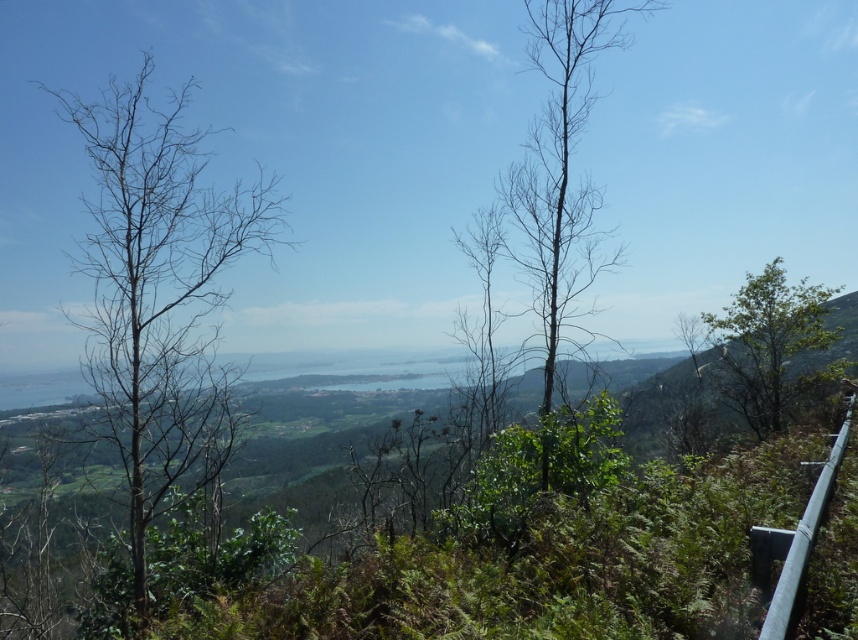
Which is above, bare wood tree at center or green leafy tree at right?

bare wood tree at center is above.

Where is `bare wood tree at center`? The image size is (858, 640). bare wood tree at center is located at coordinates (560, 168).

Does point (137, 145) come closer to viewer compared to point (754, 570)?

No.

Which is below, bare wood tree at left or silver metallic rail at right?

silver metallic rail at right is below.

Is point (246, 205) less distant than point (789, 554)?

No, it is behind (789, 554).

This screenshot has width=858, height=640. In order to click on bare wood tree at left in this screenshot , I will do `click(159, 296)`.

Is bare wood tree at left closer to the viewer compared to green leafy tree at right?

Yes, it is in front of green leafy tree at right.

What are the coordinates of `bare wood tree at left` in the screenshot? It's located at (159, 296).